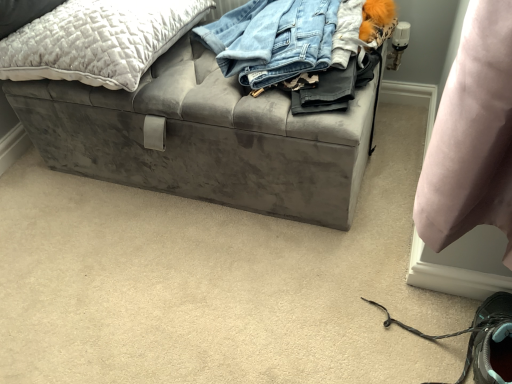
Image resolution: width=512 pixels, height=384 pixels. I want to click on vacant area that lies between velvet gray storage bench at center and gray suede shoe at lower right, so click(273, 243).